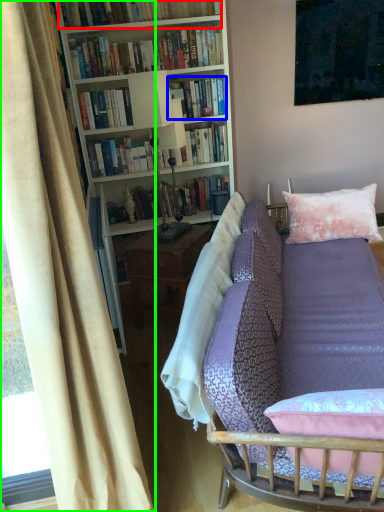
Question: Which object is the closest to the book (highlighted by a red box)? Choose among these: book (highlighted by a blue box) or curtain (highlighted by a green box).

Choices:
 (A) book
 (B) curtain

Answer: (A)